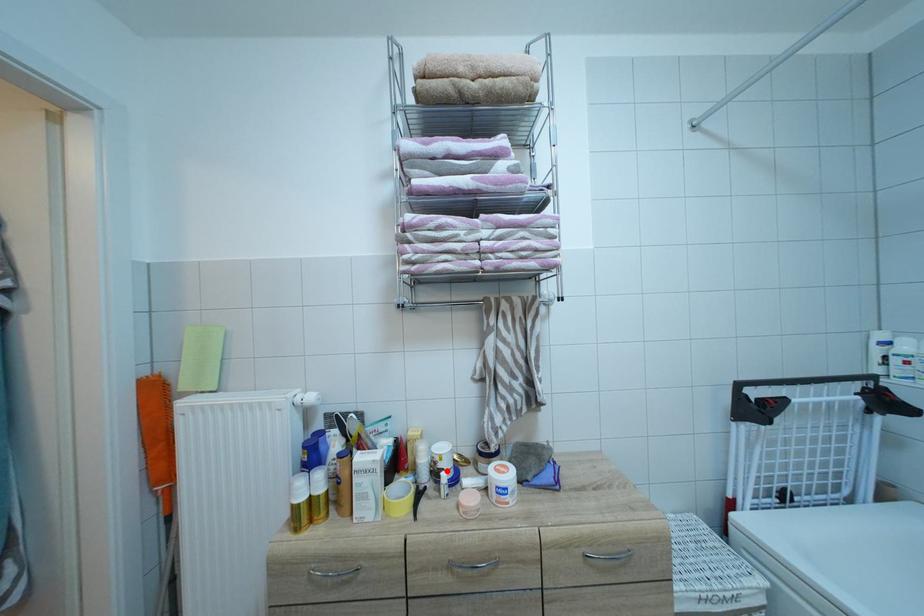
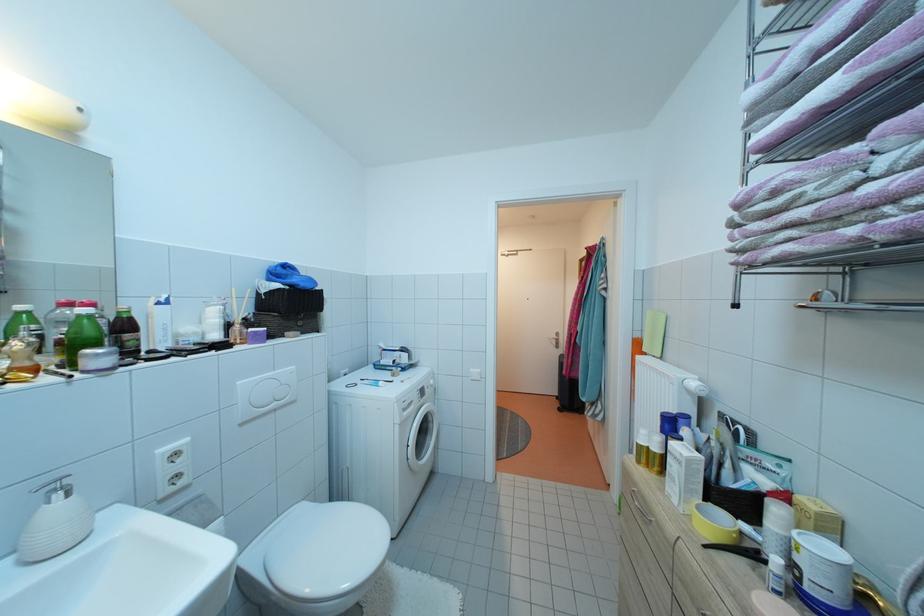
Question: I am providing you with two images of the same scene from different viewpoints. A red point is marked on the first image. Is the red point's position out of view in image 2?

Choices:
 (A) Yes
 (B) No

Answer: (B)